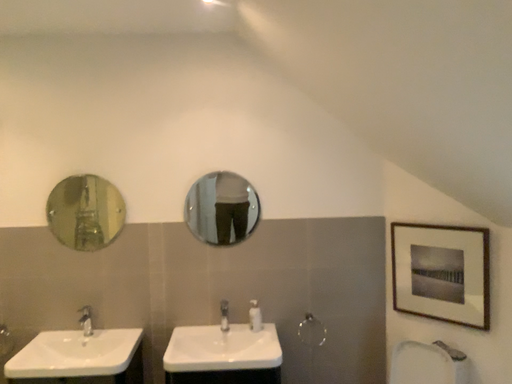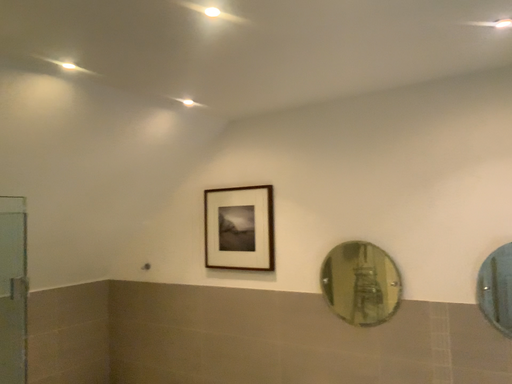
Question: Which way did the camera rotate in the video?

Choices:
 (A) rotated left
 (B) rotated right

Answer: (A)